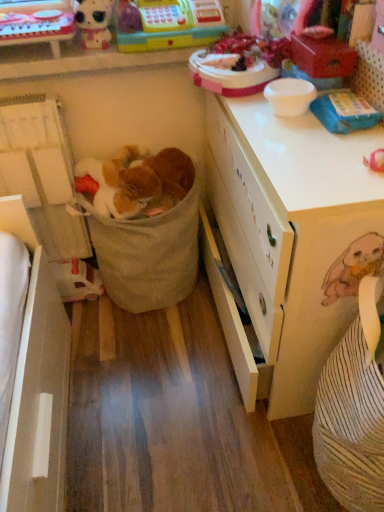
Question: Is matte plastic doll at upper left, which ranks as the 4th toy in bottom-to-top order, spatially inside white plastic toy at lower left, placed as the first toy when sorted from bottom to top, or outside of it?

Choices:
 (A) inside
 (B) outside

Answer: (B)

Question: From a real-world perspective, is matte plastic doll at upper left, which ranks as the 4th toy in bottom-to-top order, above or below white plastic toy at lower left, placed as the first toy when sorted from bottom to top?

Choices:
 (A) below
 (B) above

Answer: (B)

Question: Estimate the real-world distances between objects in this image. Which object is farther from the plastic toy cash register at upper center, arranged as the third toy when ordered from the bottom?

Choices:
 (A) white plastic toy at lower left, placed as the first toy when sorted from bottom to top
 (B) matte plastic toy at upper left
 (C) beige fabric laundry basket at center
 (D) burlap sack at center, acting as the 2th toy starting from the bottom
 (E) white matte desk at center

Answer: (A)

Question: Which is nearer to the white matte desk at center?

Choices:
 (A) matte plastic toy at upper left
 (B) plastic toy cash register at upper center, arranged as the third toy when ordered from the bottom
 (C) burlap sack at center, the third toy viewed from the top
 (D) beige fabric laundry basket at center
 (E) matte plastic doll at upper left, which ranks as the 4th toy in bottom-to-top order

Answer: (D)